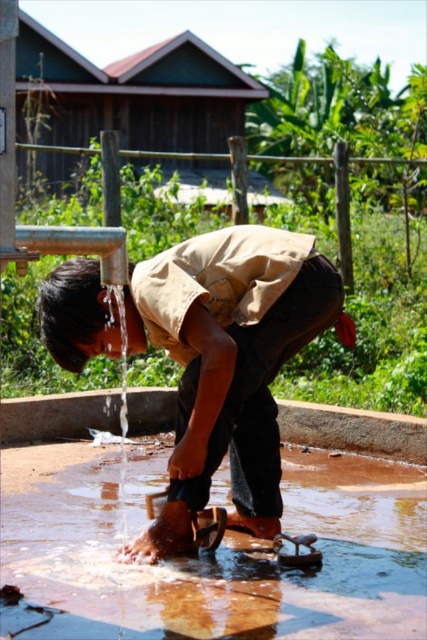
You are standing at the point marked as point (207, 394) and want to move towards the wooden structure with a sloped roof in the background. Is the point marked as point (391, 586) located behind you or in front of you relative to your direction of movement?

The point marked as point (391, 586) is behind point (207, 394), so if you are moving towards the wooden structure with a sloped roof in the background, the point (391, 586) would be behind you relative to your direction of movement.

You are standing at the water source and see the clear liquid water at lower center and the brown leather sandal at lower center. Which object is closer to you when you are facing the water source?

The clear liquid water at lower center is closer to you because it is in front of the brown leather sandal at lower center.

You are standing 10 feet away from the clear liquid water at lower center. Can you reach it without moving closer?

The clear liquid water at lower center is 8.96 feet away from the viewer. Since you are standing 10 feet away, you cannot reach it without moving closer.